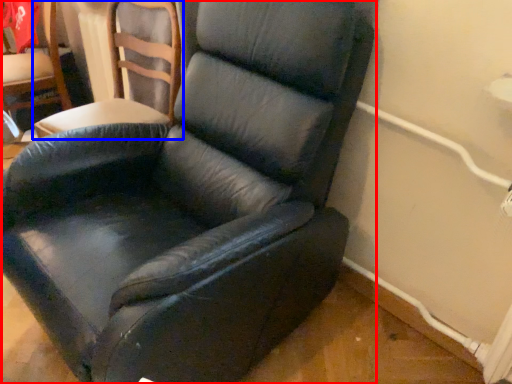
Question: Which of the following is the closest to the observer, chair (highlighted by a red box) or chair (highlighted by a blue box)?

Choices:
 (A) chair
 (B) chair

Answer: (A)